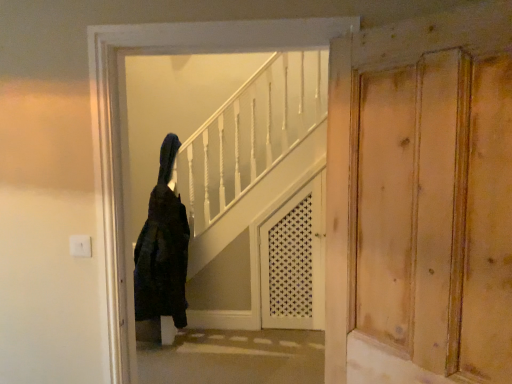
Find the location of a particular element. The width and height of the screenshot is (512, 384). vacant point above white lattice screen door at center (from a real-world perspective) is located at coordinates (290, 139).